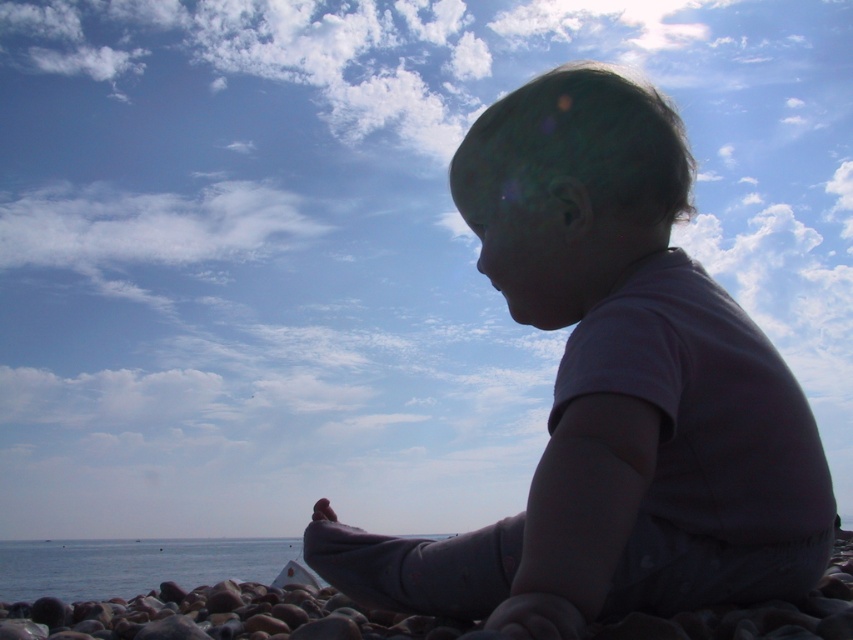
Question: Which point appears farthest from the camera in this image?

Choices:
 (A) (605, 301)
 (B) (178, 541)

Answer: (B)

Question: Is purple cotton baby at center above blue water at lower left?

Choices:
 (A) yes
 (B) no

Answer: (A)

Question: Does purple cotton baby at center come in front of blue water at lower left?

Choices:
 (A) yes
 (B) no

Answer: (A)

Question: Which object appears closest to the camera in this image?

Choices:
 (A) blue water at lower left
 (B) purple cotton baby at center

Answer: (B)

Question: Does purple cotton baby at center come behind blue water at lower left?

Choices:
 (A) yes
 (B) no

Answer: (B)

Question: Which of the following is the farthest from the observer?

Choices:
 (A) purple cotton baby at center
 (B) blue water at lower left

Answer: (B)